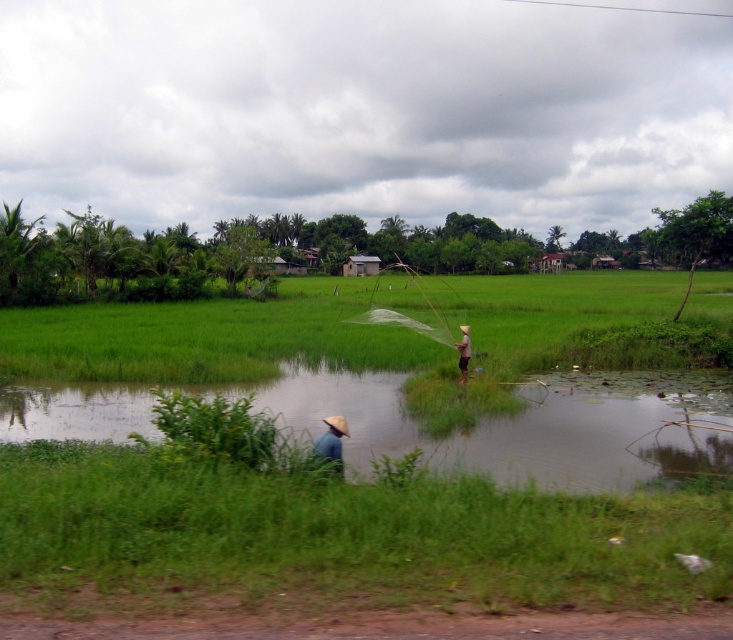
You are standing at the point marked as point (x=530, y=426) in the image. What type of terrain are you currently standing on?

The point (x=530, y=426) is on green grassy water at lower center, so you are standing on green grassy water.

You are a farmer planning to plant new crops in the green grass field at center and need to place a light brown straw hat at center as a marker. Given the sizes of both objects, will the hat be easily visible from a distance?

The green grass field at center has a larger size compared to light brown straw hat at center, so the hat may not be easily visible from a distance due to its smaller size relative to the field.